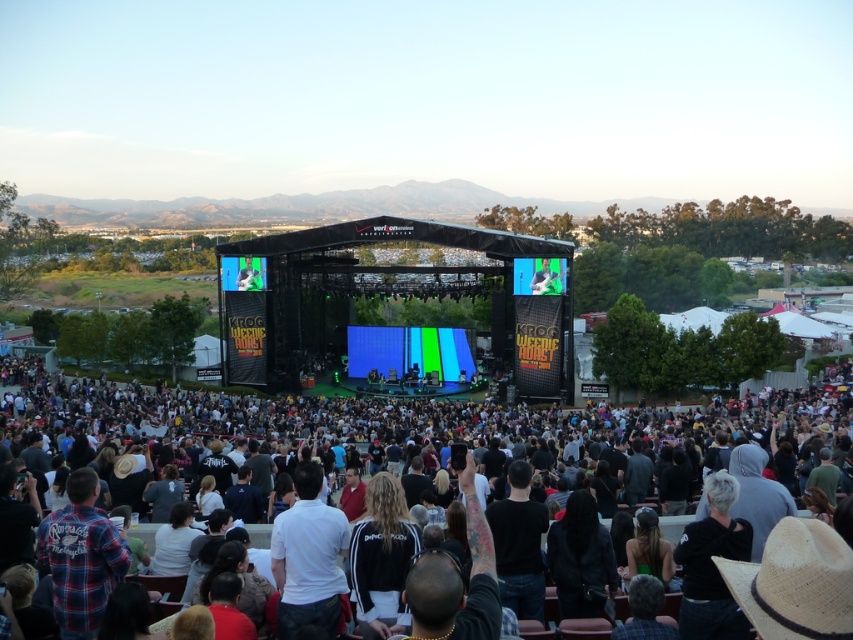
Can you confirm if black adidas jacket at center is positioned above matte blue screen at center?

Actually, black adidas jacket at center is below matte blue screen at center.

Between black adidas jacket at center and matte blue screen at center, which one is positioned lower?

black adidas jacket at center

What are the coordinates of `black adidas jacket at center` in the screenshot? It's located at (381, 557).

Find the location of `black adidas jacket at center`. black adidas jacket at center is located at coordinates (381, 557).

Between natural straw cowboy hat at lower right and black matte shirt at center, which one has less height?

With less height is natural straw cowboy hat at lower right.

Between natural straw cowboy hat at lower right and black matte shirt at center, which one has more height?

Standing taller between the two is black matte shirt at center.

Is point (715, 561) more distant than point (512, 547)?

No, (715, 561) is in front of (512, 547).

Identify the location of natural straw cowboy hat at lower right. (795, 582).

Is black fabric crowd at center positioned before black leather jacket at center?

That is True.

This screenshot has width=853, height=640. I want to click on black fabric crowd at center, so click(444, 426).

This screenshot has width=853, height=640. Find the location of `black fabric crowd at center`. black fabric crowd at center is located at coordinates (444, 426).